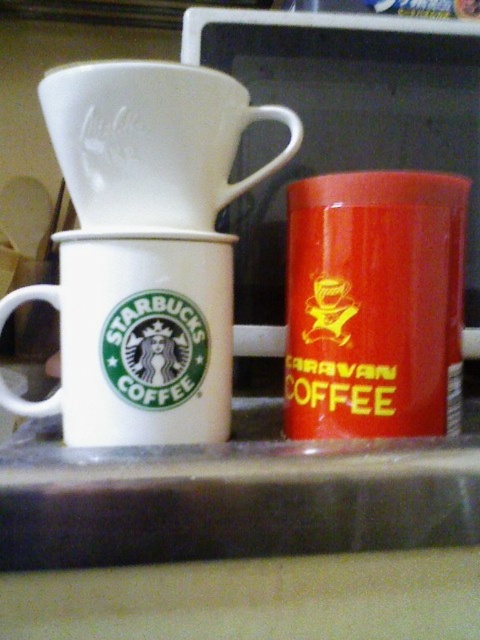
Question: Can you confirm if matte red coffee canister at right is smaller than white glossy mug at center?

Choices:
 (A) yes
 (B) no

Answer: (B)

Question: Is matte red coffee canister at right to the left of white matte coffee filter at upper center from the viewer's perspective?

Choices:
 (A) no
 (B) yes

Answer: (A)

Question: Which object is the farthest from the white matte coffee filter at upper center?

Choices:
 (A) matte red coffee canister at right
 (B) white glossy mug at center

Answer: (A)

Question: From the image, what is the correct spatial relationship of matte red coffee canister at right in relation to white glossy mug at center?

Choices:
 (A) left
 (B) right

Answer: (B)

Question: Which point appears closest to the camera in this image?

Choices:
 (A) (100, 282)
 (B) (357, 276)

Answer: (A)

Question: Which point appears farthest from the camera in this image?

Choices:
 (A) (373, 412)
 (B) (166, 365)

Answer: (A)